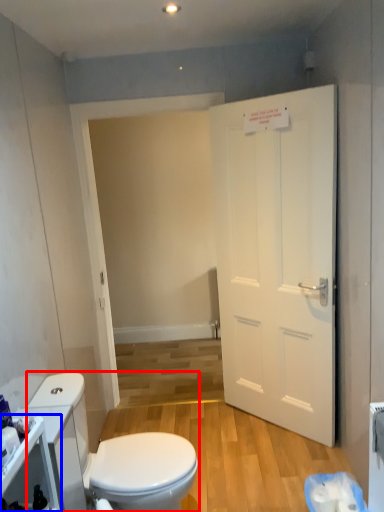
Question: Which of the following is the farthest to the observer, toilet (highlighted by a red box) or cabinetry (highlighted by a blue box)?

Choices:
 (A) toilet
 (B) cabinetry

Answer: (A)